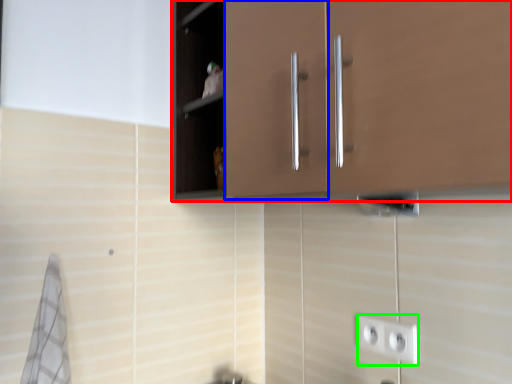
Question: Which is nearer to the cabinetry (highlighted by a red box)? cabinetry (highlighted by a blue box) or socket (highlighted by a green box).

Choices:
 (A) cabinetry
 (B) socket

Answer: (A)